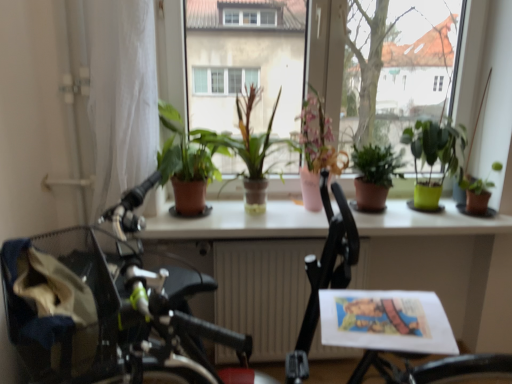
This screenshot has width=512, height=384. I want to click on vacant region below green matte plant at center, the fourth houseplant viewed from the left (from a real-world perspective), so click(381, 215).